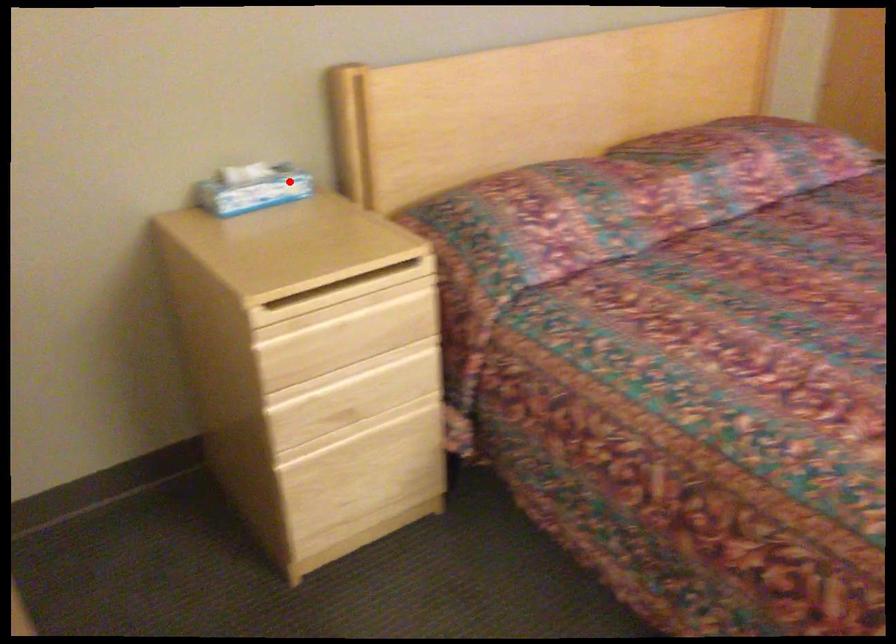
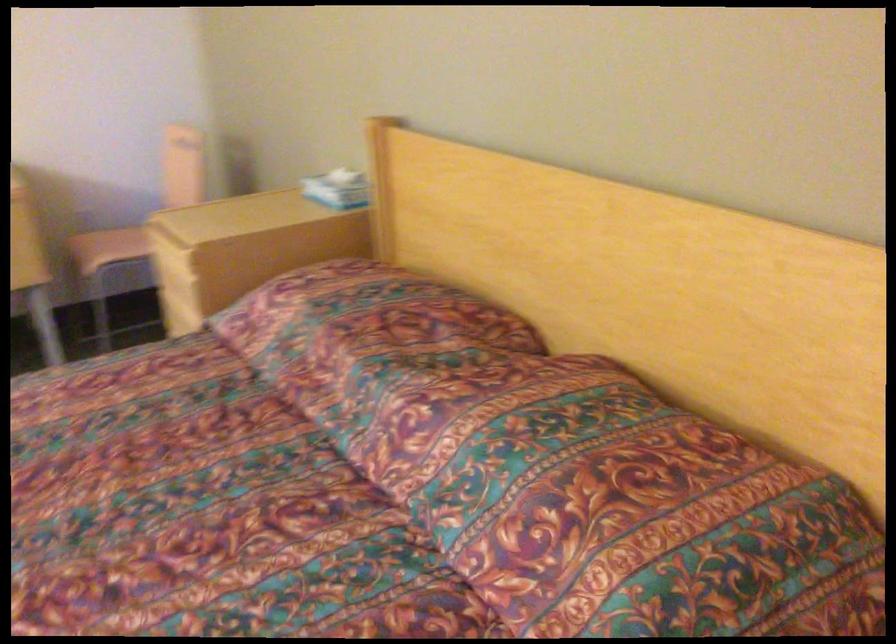
Locate, in the second image, the point that corresponds to the highlighted location in the first image.

(338, 190)